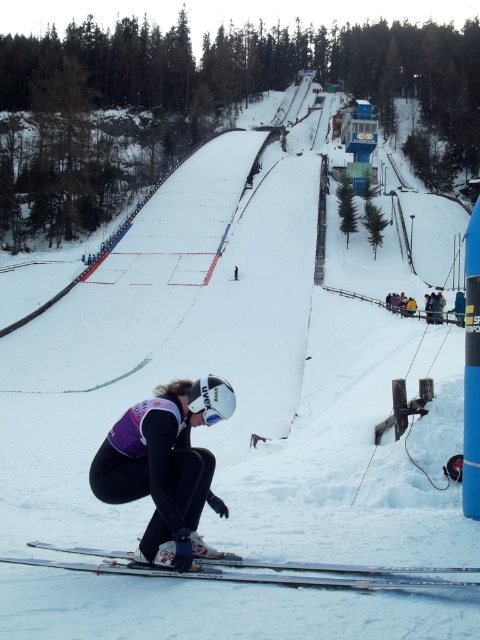
You are a photographer standing at the bottom of the ski jump ramp. You want to capture a photo of the white glossy skis at lower center and the yellow fabric jacket at right in the same frame. Which object should you focus on first to ensure both are in the frame?

The white glossy skis at lower center should be focused on first because they are shorter than the yellow fabric jacket at right, so adjusting the camera angle to include the taller jacket will naturally include the skis as well.

You are a spectator at the ski jump event. You see the white glossy skis at lower center and the yellow fabric jacket at right. Which object is located to the left of the other?

The white glossy skis at lower center are positioned on the left side of the yellow fabric jacket at right.

You are a photographer positioned at the camera. You want to capture a closeup shot of the skier preparing for takeoff. The point you need to focus on is point (189, 520). Given that you are 7.05 meters away from this point, is this distance suitable for a closeup shot?

The distance between the camera and point 0.814, 0.34 is 7.05 meters. This distance may be too far for a closeup shot, as closeups typically require being within 1 to 3 meters of the subject. Consider using a telephoto lens to achieve the desired closeup effect from this distance.